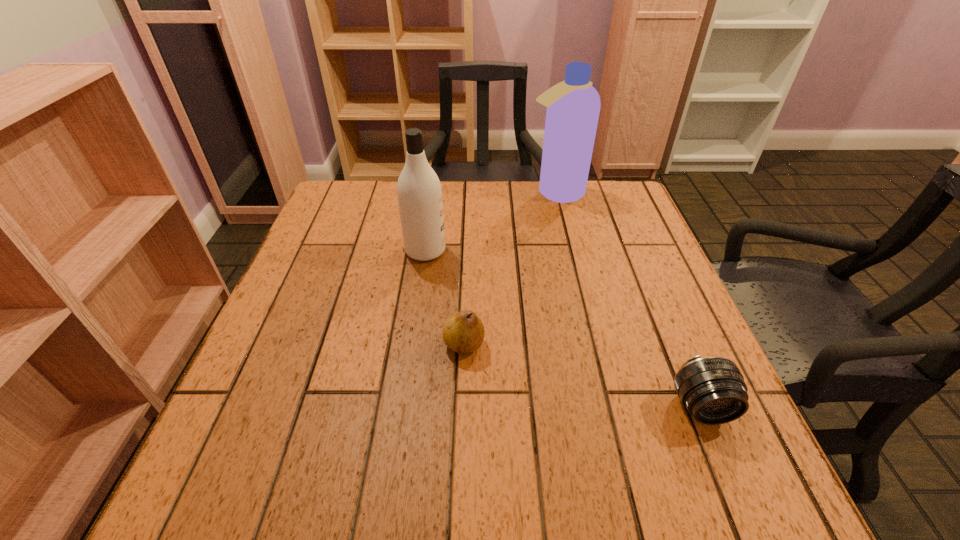
You are a GUI agent. You are given a task and a screenshot of the screen. Output one action in this format:
    pyautogui.click(x=<x>, y=<y>)
    Task: Click on the free space located 0.330m on the left of the second object from left to right
    This screenshot has width=960, height=540.
    Given the screenshot: What is the action you would take?
    pyautogui.click(x=273, y=345)

This screenshot has width=960, height=540. In order to click on vacant space located at the front element of the telephoto lens in this screenshot , I will do `click(733, 484)`.

The width and height of the screenshot is (960, 540). What are the coordinates of `object positioned at the far edge` in the screenshot? It's located at (573, 106).

The width and height of the screenshot is (960, 540). In order to click on shampoo at the right edge in this screenshot , I will do `click(573, 106)`.

This screenshot has height=540, width=960. Find the location of `telephoto lens present at the right edge`. telephoto lens present at the right edge is located at coordinates (712, 389).

Find the location of a particular element. object present at the far right corner is located at coordinates (573, 106).

The width and height of the screenshot is (960, 540). I want to click on free point at the far edge, so click(x=570, y=221).

Where is `vacant position at the near edge of the desktop`? vacant position at the near edge of the desktop is located at coordinates (490, 467).

This screenshot has height=540, width=960. I want to click on free space at the left edge of the desktop, so click(x=302, y=333).

You are a GUI agent. You are given a task and a screenshot of the screen. Output one action in this format:
    pyautogui.click(x=<x>, y=<y>)
    Task: Click on the vacant position at the right edge of the desktop
    
    Given the screenshot: What is the action you would take?
    pyautogui.click(x=651, y=268)